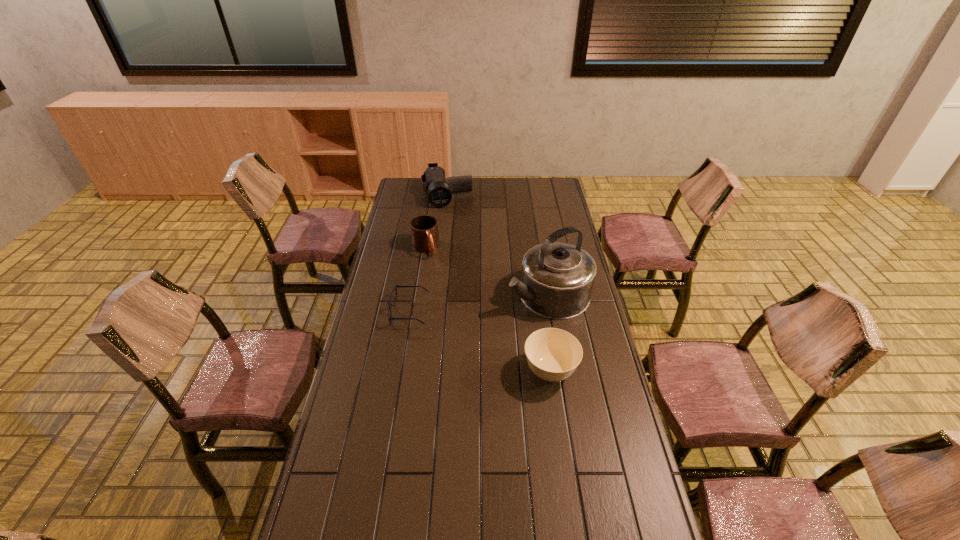
Locate an element on the screen. vacant area that satisfies the following two spatial constraints: 1. on the back side of the tallest object; 2. on the left side of the nearest object is located at coordinates (539, 294).

Locate an element on the screen. vacant space that satisfies the following two spatial constraints: 1. on the front side of the nearest object; 2. on the left side of the mug is located at coordinates (406, 372).

The image size is (960, 540). I want to click on vacant point that satisfies the following two spatial constraints: 1. on the front side of the farthest object; 2. on the left side of the kettle, so click(436, 294).